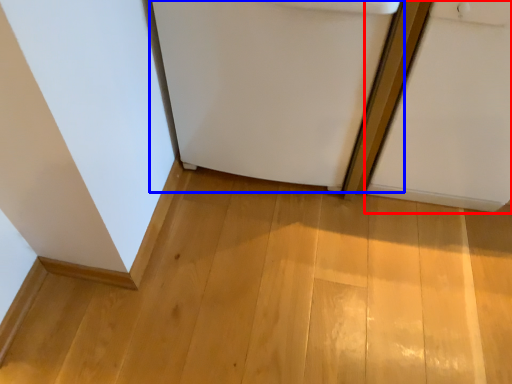
Question: Which object is closer to the camera taking this photo, door (highlighted by a red box) or refrigerator (highlighted by a blue box)?

Choices:
 (A) door
 (B) refrigerator

Answer: (A)